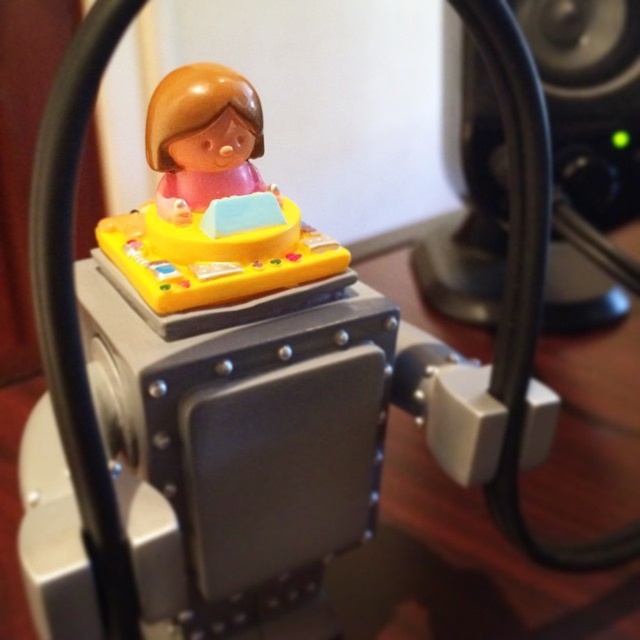
Question: Observing the image, what is the correct spatial positioning of black plastic speaker at upper right in reference to matte plastic figurine at center?

Choices:
 (A) above
 (B) below

Answer: (A)

Question: Can you confirm if black plastic speaker at upper right is positioned above matte plastic figurine at center?

Choices:
 (A) yes
 (B) no

Answer: (A)

Question: Is black plastic speaker at upper right closer to the viewer compared to matte plastic figurine at center?

Choices:
 (A) no
 (B) yes

Answer: (A)

Question: Which of the following is the farthest from the observer?

Choices:
 (A) black plastic speaker at upper right
 (B) matte plastic figurine at center

Answer: (A)

Question: Among these points, which one is nearest to the camera?

Choices:
 (A) (456, 72)
 (B) (161, 157)

Answer: (B)